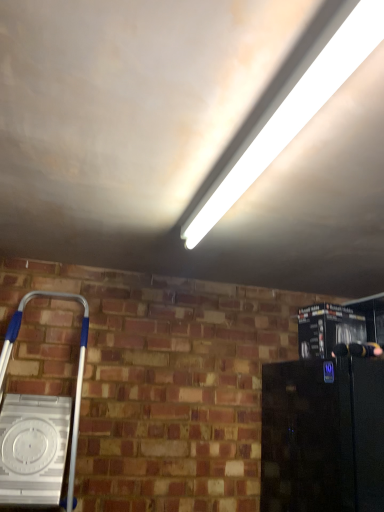
Question: From a real-world perspective, is white fluorescent tube at upper center on top of metallic black coffee maker at right, the first appliance when ordered from top to bottom?

Choices:
 (A) no
 (B) yes

Answer: (B)

Question: Is white fluorescent tube at upper center at the left side of metallic black coffee maker at right, the 2th appliance from the bottom?

Choices:
 (A) no
 (B) yes

Answer: (B)

Question: Can we say white fluorescent tube at upper center lies outside metallic black coffee maker at right, the 2th appliance from the bottom?

Choices:
 (A) yes
 (B) no

Answer: (A)

Question: Does white fluorescent tube at upper center have a greater width compared to metallic black coffee maker at right, the first appliance when ordered from top to bottom?

Choices:
 (A) no
 (B) yes

Answer: (A)

Question: Does white fluorescent tube at upper center have a lesser width compared to metallic black coffee maker at right, the first appliance when ordered from top to bottom?

Choices:
 (A) no
 (B) yes

Answer: (B)

Question: Considering the positions of metallic black coffee maker at right, the first appliance when ordered from top to bottom, and black glossy refrigerator at lower right, which is the first appliance in bottom-to-top order, in the image, is metallic black coffee maker at right, the first appliance when ordered from top to bottom, wider or thinner than black glossy refrigerator at lower right, which is the first appliance in bottom-to-top order,?

Choices:
 (A) wide
 (B) thin

Answer: (B)

Question: Is metallic black coffee maker at right, the first appliance when ordered from top to bottom, bigger or smaller than black glossy refrigerator at lower right, which is the first appliance in bottom-to-top order?

Choices:
 (A) small
 (B) big

Answer: (A)

Question: Considering the positions of point (337, 321) and point (288, 485), is point (337, 321) closer or farther from the camera than point (288, 485)?

Choices:
 (A) closer
 (B) farther

Answer: (A)

Question: Is metallic black coffee maker at right, the first appliance when ordered from top to bottom, situated inside black glossy refrigerator at lower right, placed as the 2th appliance when sorted from top to bottom, or outside?

Choices:
 (A) inside
 (B) outside

Answer: (B)

Question: In the image, is metallic black coffee maker at right, the first appliance when ordered from top to bottom, positioned in front of or behind white fluorescent tube at upper center?

Choices:
 (A) front
 (B) behind

Answer: (B)

Question: Is point (306, 331) closer or farther from the camera than point (263, 129)?

Choices:
 (A) closer
 (B) farther

Answer: (B)

Question: Is metallic black coffee maker at right, the 2th appliance from the bottom, bigger or smaller than white fluorescent tube at upper center?

Choices:
 (A) small
 (B) big

Answer: (B)

Question: From the image's perspective, relative to white fluorescent tube at upper center, is metallic black coffee maker at right, the first appliance when ordered from top to bottom, above or below?

Choices:
 (A) above
 (B) below

Answer: (B)

Question: From the image's perspective, is white fluorescent tube at upper center located above or below black glossy refrigerator at lower right, which is the first appliance in bottom-to-top order?

Choices:
 (A) above
 (B) below

Answer: (A)

Question: Looking at the image, does white fluorescent tube at upper center seem bigger or smaller compared to black glossy refrigerator at lower right, which is the first appliance in bottom-to-top order?

Choices:
 (A) big
 (B) small

Answer: (B)